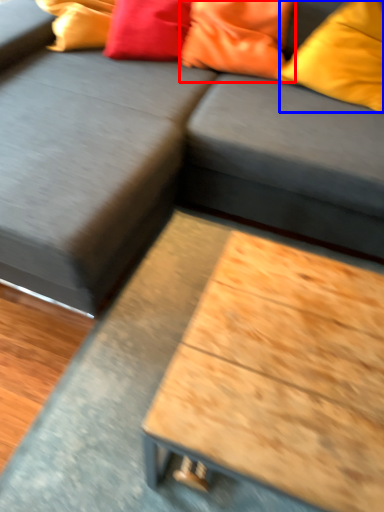
Question: Which object is closer to the camera taking this photo, pillow (highlighted by a red box) or pillow (highlighted by a blue box)?

Choices:
 (A) pillow
 (B) pillow

Answer: (B)